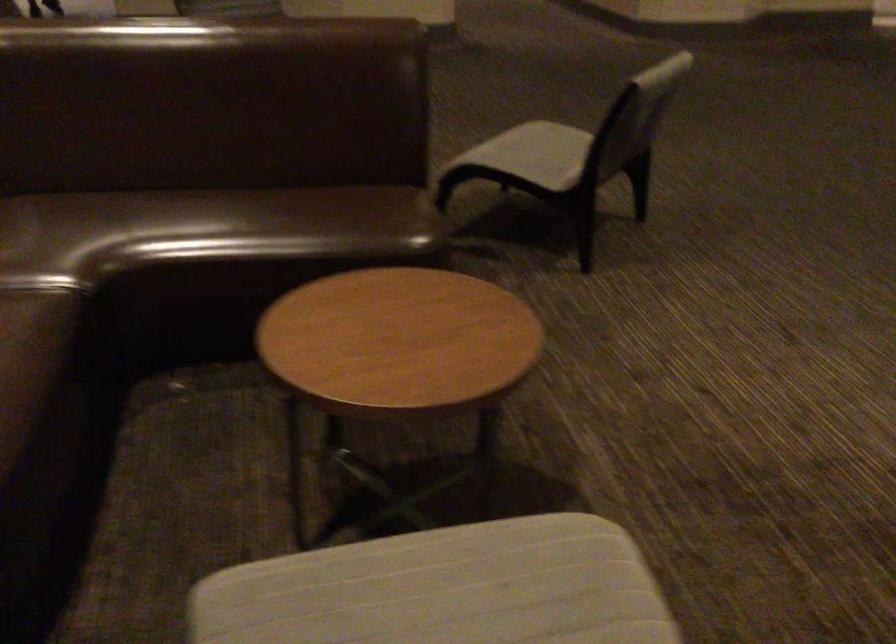
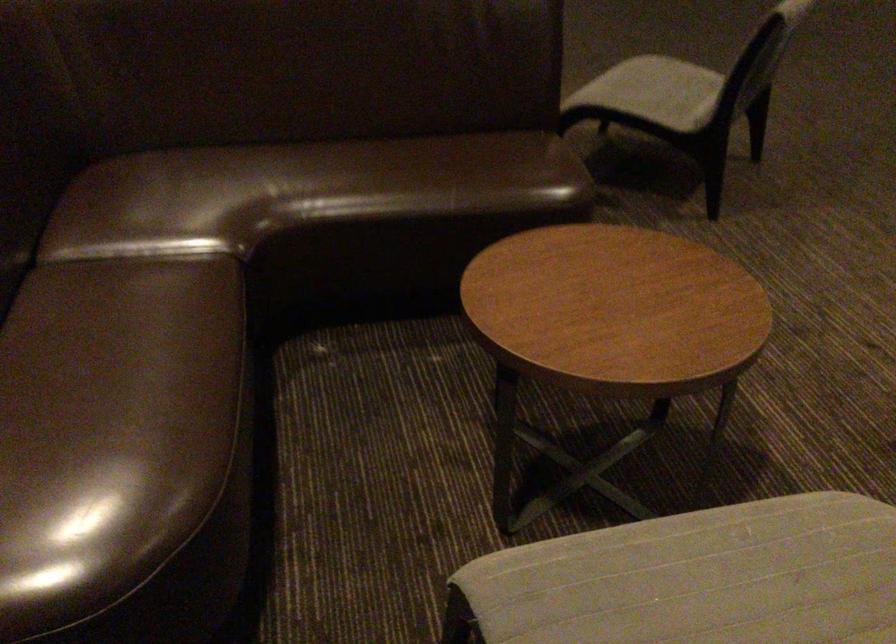
Where in the second image is the point corresponding to point 192,223 from the first image?

(334, 180)